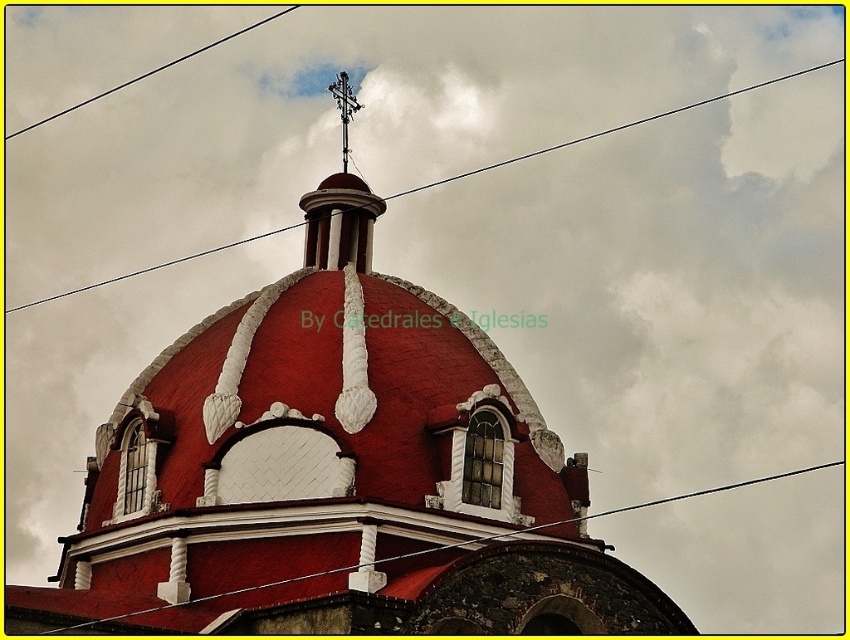
Does black wire at upper center appear over black wire at upper left?

No, black wire at upper center is not above black wire at upper left.

What do you see at coordinates (612, 129) in the screenshot? The height and width of the screenshot is (640, 850). I see `black wire at upper center` at bounding box center [612, 129].

Where is `black wire at upper center`? This screenshot has height=640, width=850. black wire at upper center is located at coordinates [612, 129].

Can you confirm if metallic wire at upper center is taller than black wire at upper center?

No, metallic wire at upper center is not taller than black wire at upper center.

The height and width of the screenshot is (640, 850). Describe the element at coordinates (346, 582) in the screenshot. I see `metallic wire at upper center` at that location.

Is point (112, 596) closer to viewer compared to point (38, 304)?

That is True.

I want to click on metallic wire at upper center, so click(346, 582).

Does metallic wire at upper center appear over black wire at upper left?

No.

How much distance is there between metallic wire at upper center and black wire at upper left?

metallic wire at upper center and black wire at upper left are 236.52 feet apart from each other.

Is point (183, 630) closer to camera compared to point (63, 112)?

Yes, point (183, 630) is closer to viewer.

Locate an element on the screen. metallic wire at upper center is located at coordinates (346, 582).